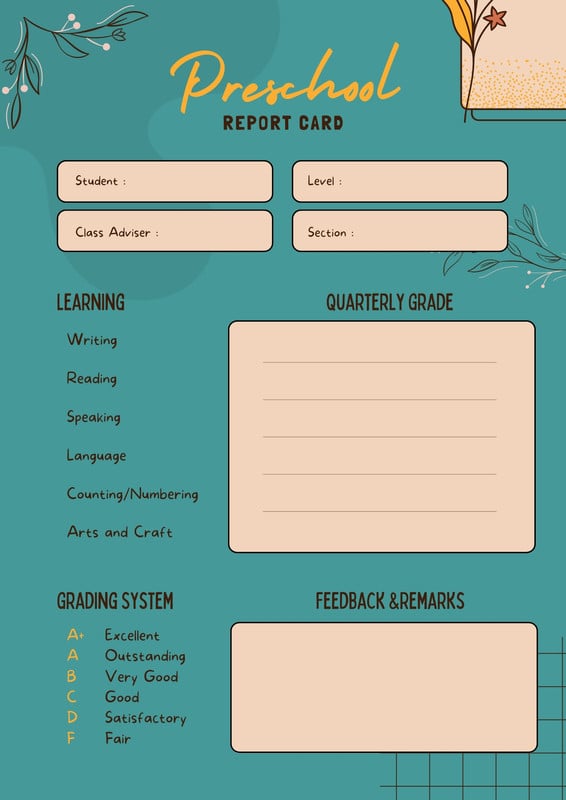
At what (x,y) coordinates should I click in order to perform the action: click on box. Please return your answer as a coordinate pair (x, y). Looking at the image, I should click on (213, 232).